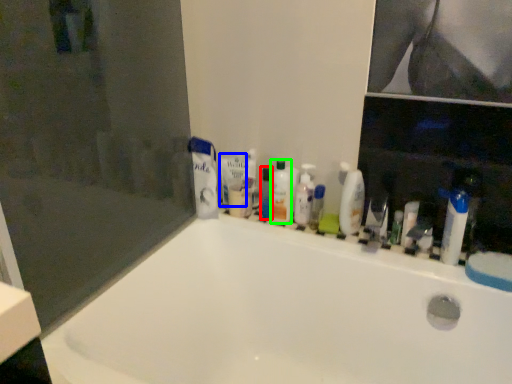
Question: Which is nearer to the toiletry (highlighted by a red box)? toothpaste (highlighted by a blue box) or mouthwash (highlighted by a green box).

Choices:
 (A) toothpaste
 (B) mouthwash

Answer: (B)